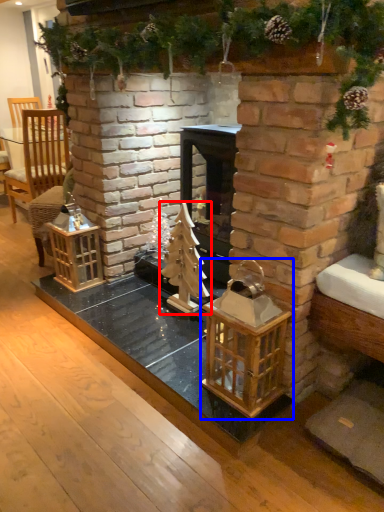
Question: Which point is closer to the camera, christmas tree (highlighted by a red box) or cage (highlighted by a blue box)?

Choices:
 (A) christmas tree
 (B) cage

Answer: (B)